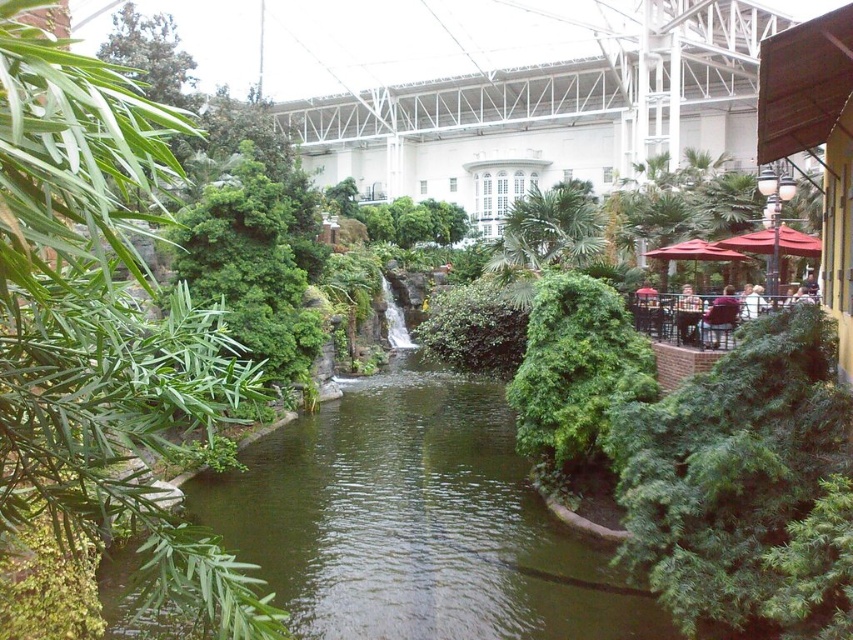
You are planning to install a new lighting system in the indoor garden. You have a spotlight that can reach up to 3 meters. The green leafy tree at left and the red fabric umbrella at right are both in your path. Which object will require the spotlight to be adjusted to its maximum height to illuminate properly?

The green leafy tree at left is taller than the red fabric umbrella at right, so the spotlight will need to be adjusted to its maximum height to illuminate the green leafy tree at left properly.

Please provide the coordinates of the green leafy tree at left in the image. The coordinates should be in the format of a tuple with two decimal numbers, such as 0.530, 0.124.

The coordinates of the green leafy tree at left are at point (105, 339).

You are a drone operator who needs to fly a drone from your current position to the green leafy palm tree at center. The drone has a maximum flight range of 30 meters. Can the drone reach the tree?

The distance between the green leafy palm tree at center and the camera is 35.46 meters, which exceeds the drone operator drone has a maximum flight range of 30 meters. Therefore, the drone cannot reach the green leafy palm tree at center.